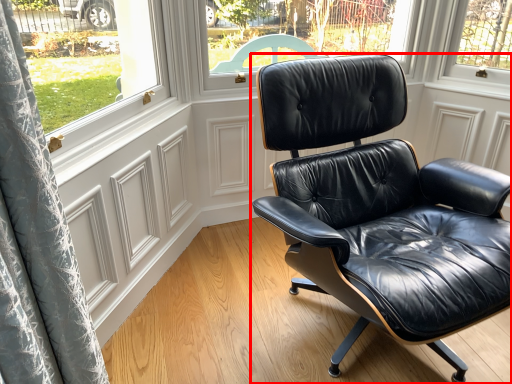
Question: In this image, where is chair (annotated by the red box) located relative to screen door?

Choices:
 (A) right
 (B) left

Answer: (A)